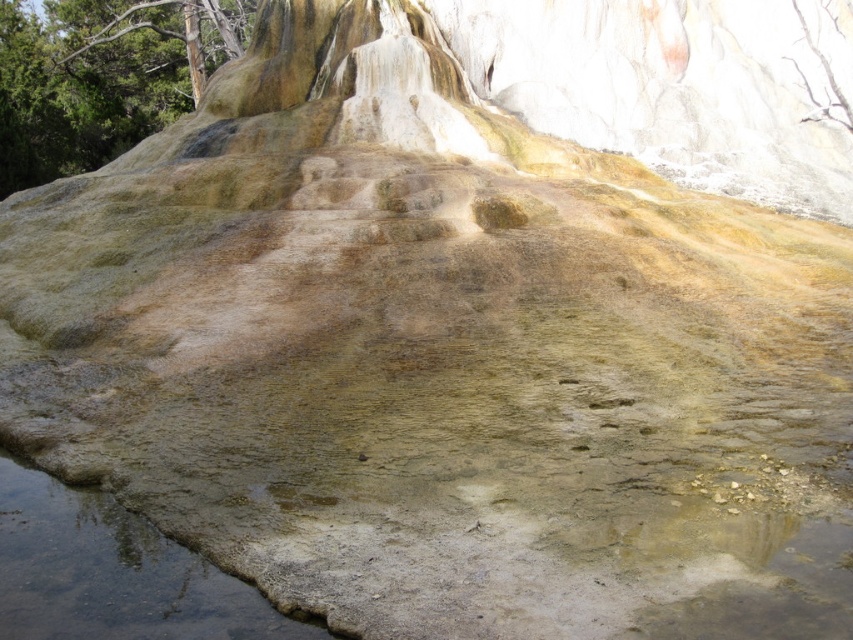
Is smooth bark tree at upper left wider than clear water at bottom left?

Yes, smooth bark tree at upper left is wider than clear water at bottom left.

Does point (54, 64) come closer to viewer compared to point (61, 515)?

No, (54, 64) is behind (61, 515).

Which is behind, point (210, 33) or point (21, 508)?

The point (210, 33) is more distant.

At what (x,y) coordinates should I click in order to perform the action: click on smooth bark tree at upper left. Please return your answer as a coordinate pair (x, y). This screenshot has height=640, width=853. Looking at the image, I should click on (102, 76).